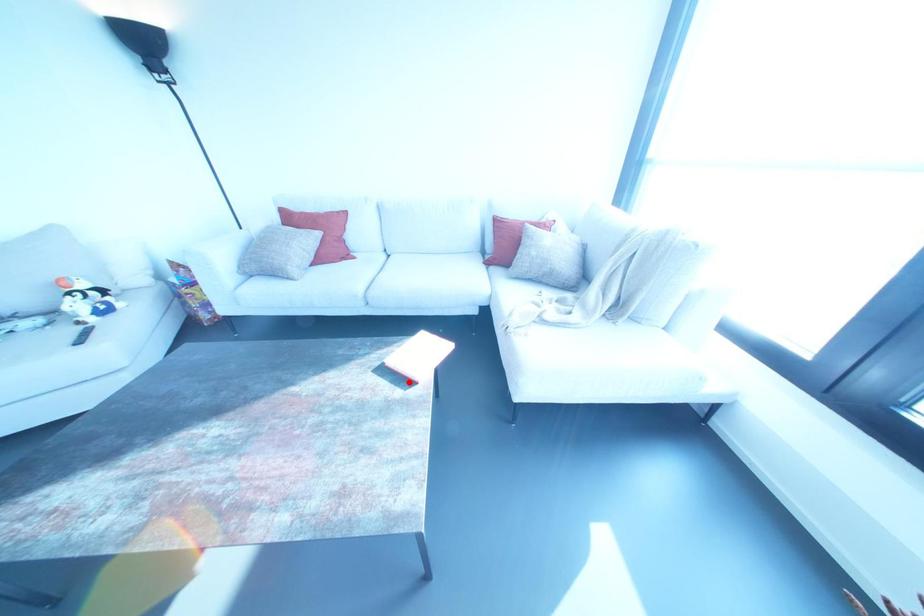
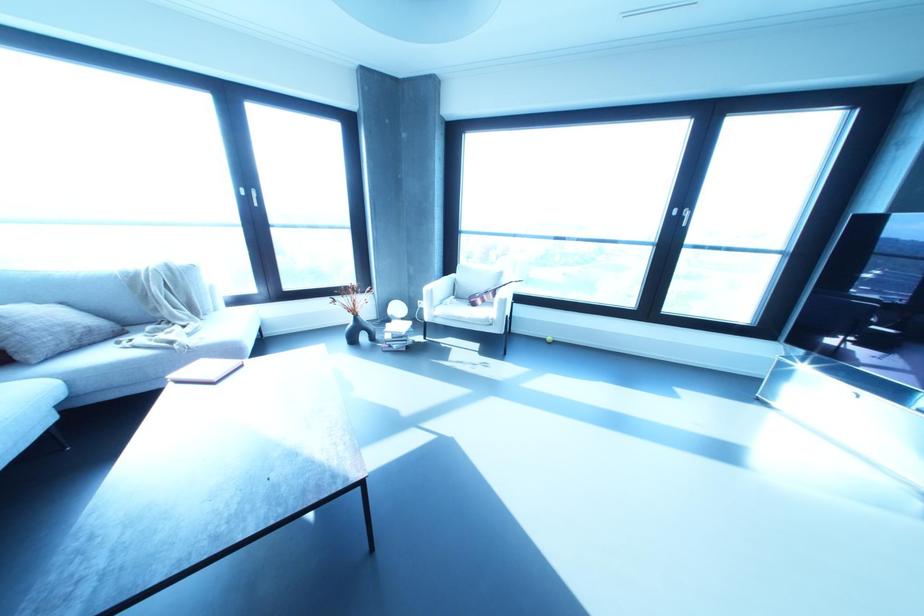
Question: A red point is marked in image1. In image2, is the corresponding 3D point closer to the camera or farther? Reply with the corresponding letter.

Choices:
 (A) The corresponding 3D point is closer.
 (B) The corresponding 3D point is farther.

Answer: (A)